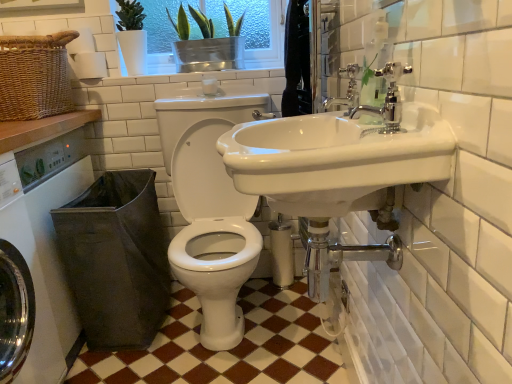
Question: Considering the positions of point (26, 119) and point (172, 289), is point (26, 119) closer or farther from the camera than point (172, 289)?

Choices:
 (A) farther
 (B) closer

Answer: (B)

Question: From their relative heights in the image, would you say woven brown basket at upper left is taller or shorter than brown/white checkered floor at center?

Choices:
 (A) short
 (B) tall

Answer: (B)

Question: Estimate the real-world distances between objects in this image. Which object is closer to the dark brown fabric laundry basket at lower left?

Choices:
 (A) green glass window screen at upper center
 (B) white glossy toilet at center
 (C) woven brown basket at upper left
 (D) white glossy sink at center
 (E) brown/white checkered floor at center

Answer: (B)

Question: Which of these objects is positioned farthest from the white matte toilet paper at upper left?

Choices:
 (A) white glossy toilet at center
 (B) chrome metallic faucet at upper right, marked as the 2th tap in a front-to-back arrangement
 (C) brown/white checkered floor at center
 (D) polished chrome faucet at upper right, the first tap when ordered from front to back
 (E) dark brown fabric laundry basket at lower left

Answer: (D)